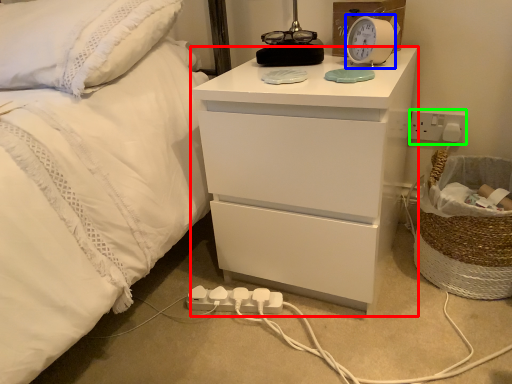
Question: Considering the real-world distances, which object is farthest from chest of drawers (highlighted by a red box)? alarm clock (highlighted by a blue box) or electric outlet (highlighted by a green box)?

Choices:
 (A) alarm clock
 (B) electric outlet

Answer: (B)